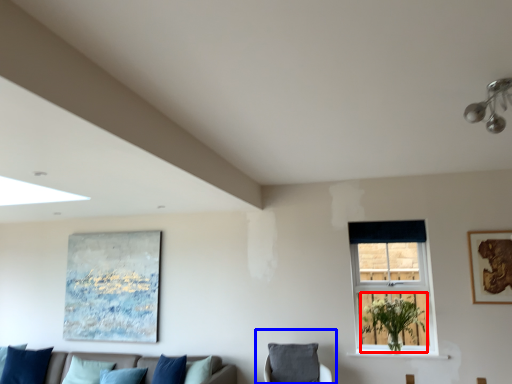
Question: Which point is further to the camera, plant (highlighted by a red box) or swivel chair (highlighted by a blue box)?

Choices:
 (A) plant
 (B) swivel chair

Answer: (A)